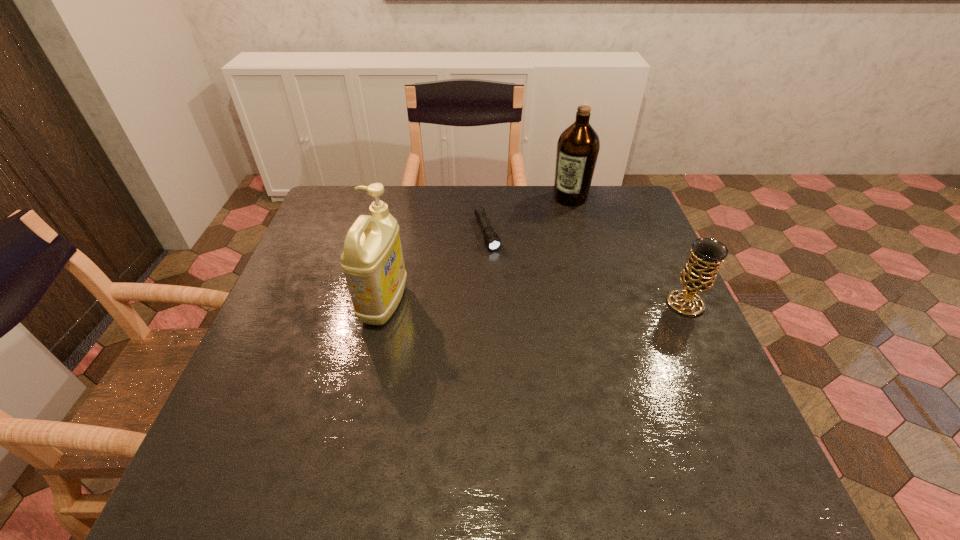
You are a GUI agent. You are given a task and a screenshot of the screen. Output one action in this format:
    pyautogui.click(x=<x>, y=<y>)
    Task: Click on the leftmost object
    Image resolution: width=960 pixels, height=540 pixels.
    Given the screenshot: What is the action you would take?
    pyautogui.click(x=372, y=260)

Where is `chalice`? Image resolution: width=960 pixels, height=540 pixels. chalice is located at coordinates (699, 273).

The image size is (960, 540). I want to click on the second shortest object, so click(x=699, y=273).

Identify the location of the second farthest object. (492, 240).

At what (x,y) coordinates should I click in order to perform the action: click on the shortest object. Please return your answer as a coordinate pair (x, y). Looking at the image, I should click on (492, 240).

Image resolution: width=960 pixels, height=540 pixels. I want to click on the second object from right to left, so click(x=578, y=146).

In order to click on olive oil in this screenshot , I will do `click(578, 146)`.

Image resolution: width=960 pixels, height=540 pixels. In order to click on vacant space situated 0.130m on the back of the leftmost object in this screenshot , I will do `click(396, 248)`.

Where is `free space located on the back of the rightmost object`? The height and width of the screenshot is (540, 960). free space located on the back of the rightmost object is located at coordinates (644, 215).

The height and width of the screenshot is (540, 960). Find the location of `vacant region located 0.150m at the lens end of the second farthest object`. vacant region located 0.150m at the lens end of the second farthest object is located at coordinates (507, 288).